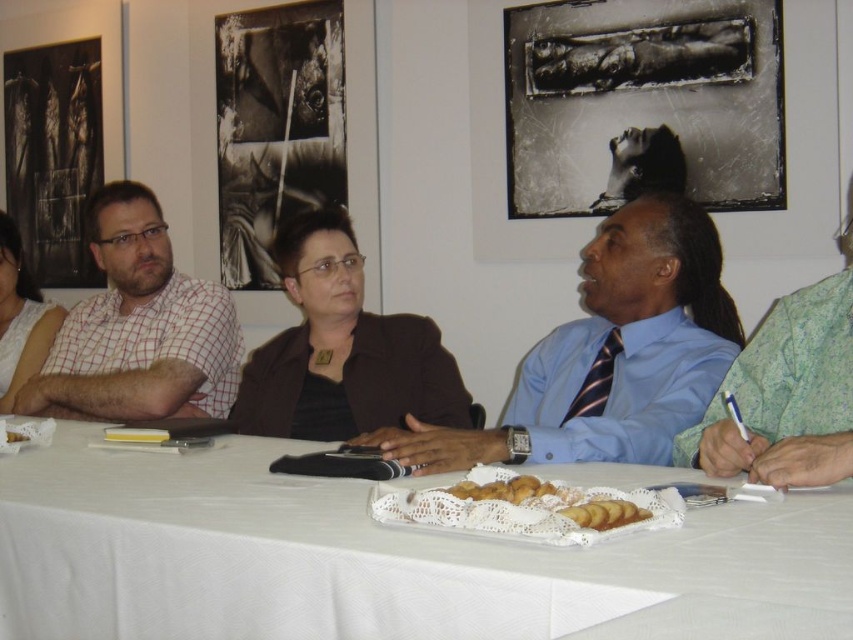
You are organizing a team meeting and need to seat participants based on their clothing colors. The blue shirt and tie at center and the green floral shirt at right are present. Which participant should you seat first if you want to start with the larger clothing size?

The blue shirt and tie at center should be seated first because it is larger than the green floral shirt at right.